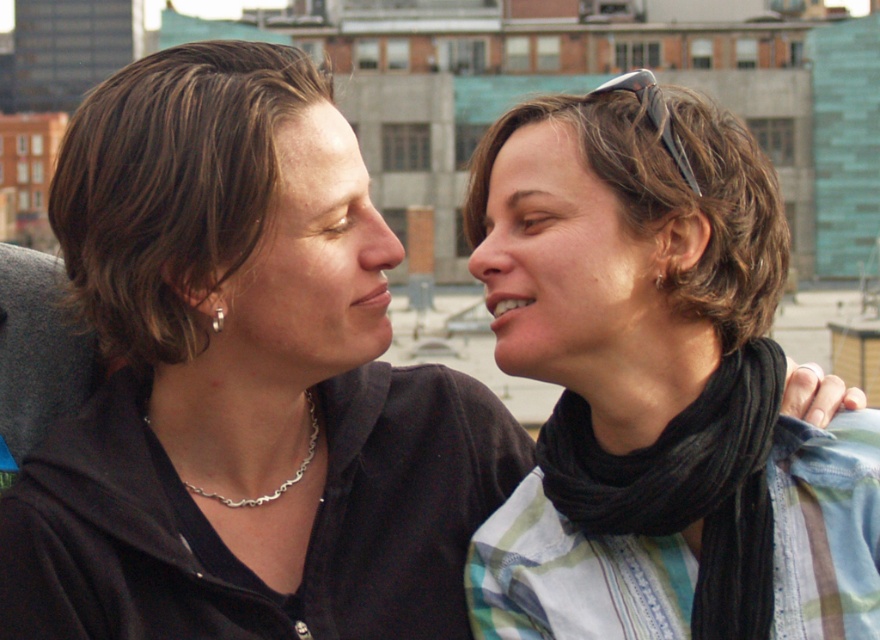
You are a photographer trying to capture a closeup shot of both the dark brown hair at center and the silver chain necklace at center in the scene. Given that your camera has a maximum focus range of 5 meters, will you be able to capture both objects in focus simultaneously?

The dark brown hair at center and silver chain necklace at center are 5.42 meters apart. Since the camera can only focus within 5 meters, the distance between them exceeds the maximum focus range. Therefore, you cannot capture both objects in focus at the same time.